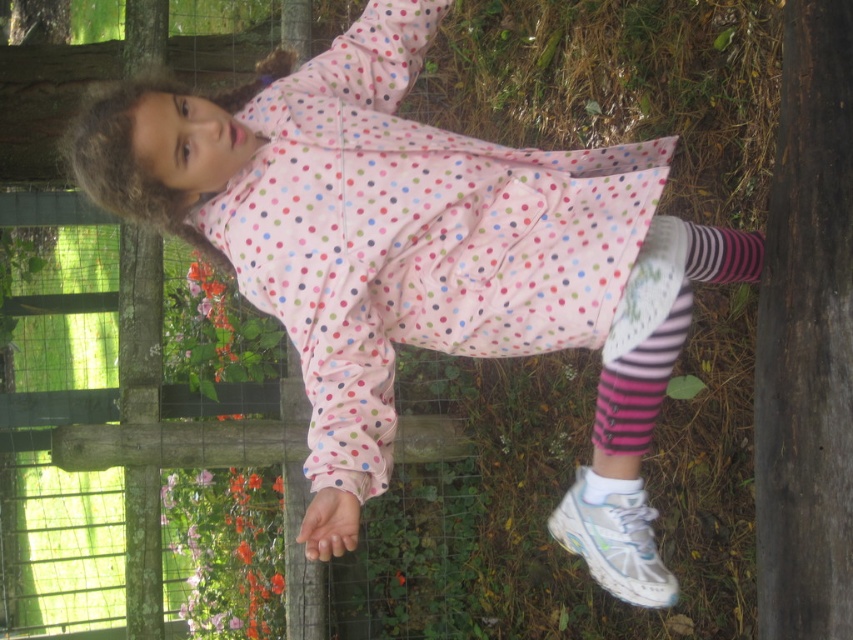
You are a photographer trying to capture the girl in the image. You want to focus on the point closer to the camera between the two points labeled point (589, 544) and point (622, 493). Which point should you focus on?

You should focus on point (589, 544) because it is further to the camera than point (622, 493), making it the closer point to focus on.

You are standing at the point labeled as point (587, 540) in the image. The young girl is running towards you. If you want to move to a safe distance of 10 feet away from her, which direction should you move? Please provide your answer in terms of the image coordinates system where the origin is at the bottom left corner, and the coordinates range from 0 to 1 in both x and y axes.

Since the point (587, 540) is currently 8.01 feet away from the viewer, and the desired safe distance is 10 feet, you should move in the direction away from the girl. In the image coordinate system, moving towards higher x or y coordinates would increase the distance. However, without knowing the girl s exact position relative to the point, it is impossible to determine the exact direction. The question might be better phrased to include the girl s position or the direction she is moving relative to the.

You are a photographer trying to capture the exact position of the white mesh shoe at lower right in the image. According to the coordinates provided, where should you focus your camera lens to ensure the shoe is centered in the frame?

You should focus your camera lens at point (614, 544) to center the white mesh shoe at lower right in the frame.